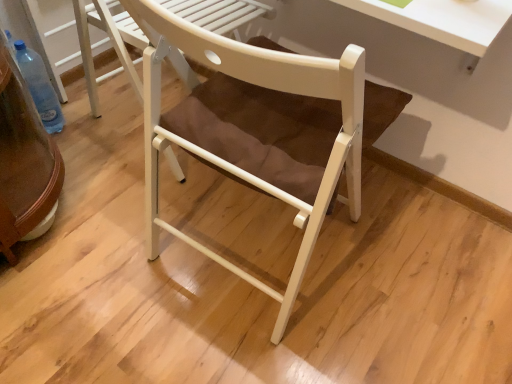
Where is `vacant area in front of white wood chair at center, which is counted as the second chair, starting from the back`? vacant area in front of white wood chair at center, which is counted as the second chair, starting from the back is located at coordinates (243, 345).